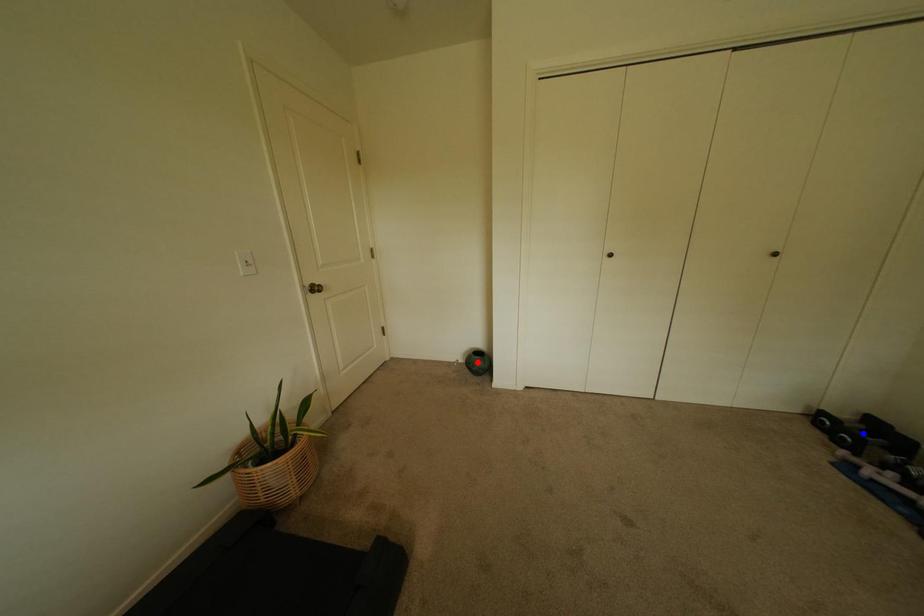
Question: Two points are marked on the image. Which point is closer to the camera?

Choices:
 (A) Blue point is closer.
 (B) Red point is closer.

Answer: (A)